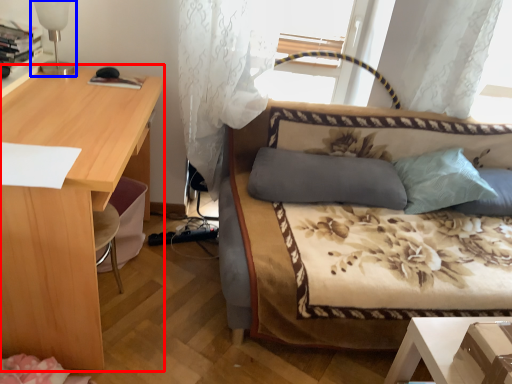
Question: Among these objects, which one is farthest to the camera, desk (highlighted by a red box) or table lamp (highlighted by a blue box)?

Choices:
 (A) desk
 (B) table lamp

Answer: (B)